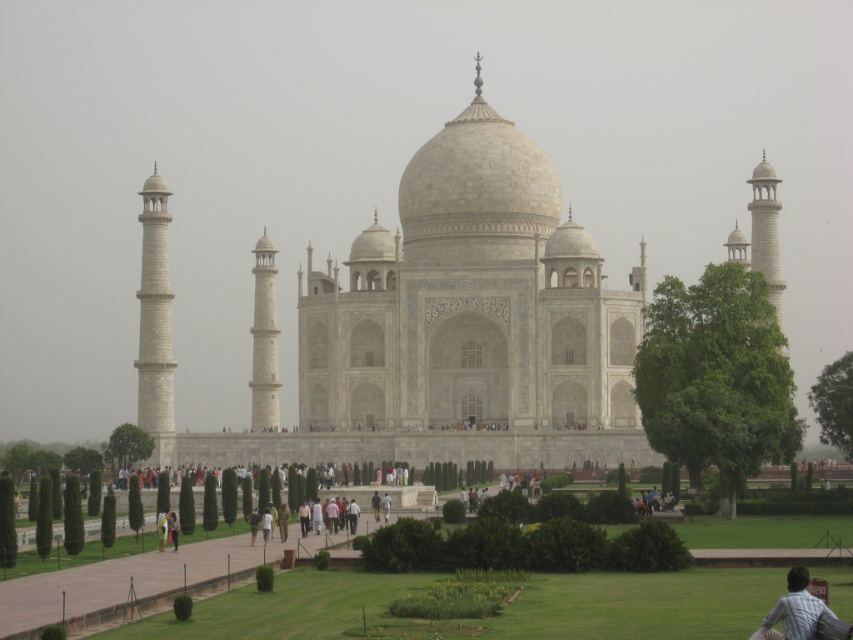
Question: Is white marble taj mahal at center thinner than light brown striped shirt at lower right?

Choices:
 (A) no
 (B) yes

Answer: (A)

Question: Can you confirm if white marble taj mahal at center is bigger than green grass at center?

Choices:
 (A) no
 (B) yes

Answer: (B)

Question: Which object is positioned farthest from the green grass at center?

Choices:
 (A) white marble taj mahal at center
 (B) light brown striped shirt at lower right

Answer: (A)

Question: Can you confirm if white marble taj mahal at center is thinner than light brown striped shirt at lower right?

Choices:
 (A) no
 (B) yes

Answer: (A)

Question: Which point appears farthest from the camera in this image?

Choices:
 (A) (485, 417)
 (B) (202, 611)
 (C) (770, 620)

Answer: (A)

Question: Which object appears closest to the camera in this image?

Choices:
 (A) green grass at center
 (B) light brown striped shirt at lower right
 (C) white marble taj mahal at center

Answer: (B)